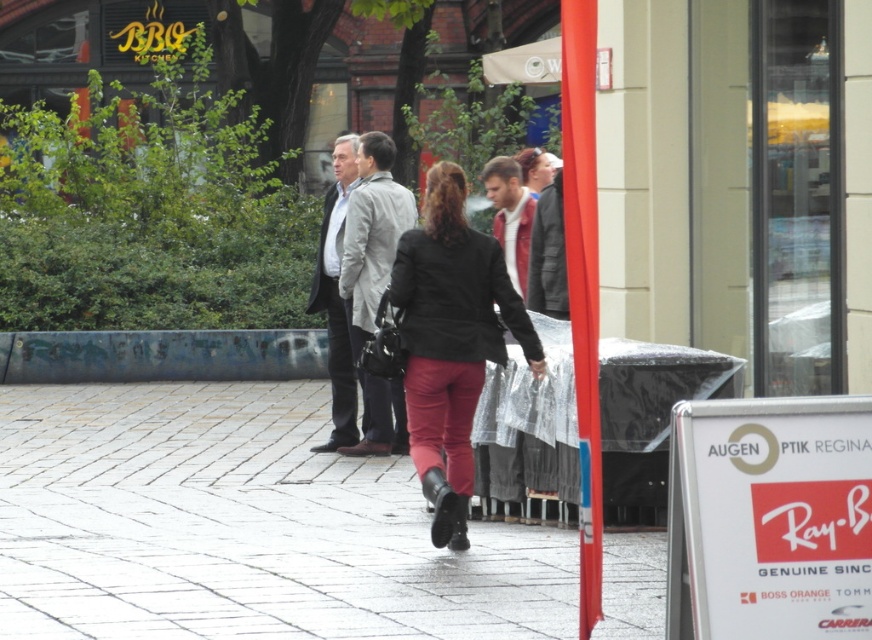
Based on the photo, does smooth stone pavement at center appear over dark gray wool coat at center?

Actually, smooth stone pavement at center is below dark gray wool coat at center.

Is smooth stone pavement at center shorter than dark gray wool coat at center?

Yes, smooth stone pavement at center is shorter than dark gray wool coat at center.

The image size is (872, 640). Describe the element at coordinates (242, 528) in the screenshot. I see `smooth stone pavement at center` at that location.

Find the location of a particular element. smooth stone pavement at center is located at coordinates (242, 528).

Can you confirm if smooth stone pavement at center is bigger than matte black blazer at center?

No, smooth stone pavement at center is not bigger than matte black blazer at center.

Is smooth stone pavement at center below matte black blazer at center?

Correct, smooth stone pavement at center is located below matte black blazer at center.

Is point (208, 458) behind point (509, 260)?

That is True.

The height and width of the screenshot is (640, 872). In order to click on smooth stone pavement at center in this screenshot , I will do `click(242, 528)`.

Can you confirm if light gray fabric coat at center is shorter than matte black blazer at center?

No, light gray fabric coat at center is not shorter than matte black blazer at center.

Does light gray fabric coat at center have a greater height compared to matte black blazer at center?

Yes.

The width and height of the screenshot is (872, 640). Describe the element at coordinates (371, 234) in the screenshot. I see `light gray fabric coat at center` at that location.

What are the coordinates of `light gray fabric coat at center` in the screenshot? It's located at (371, 234).